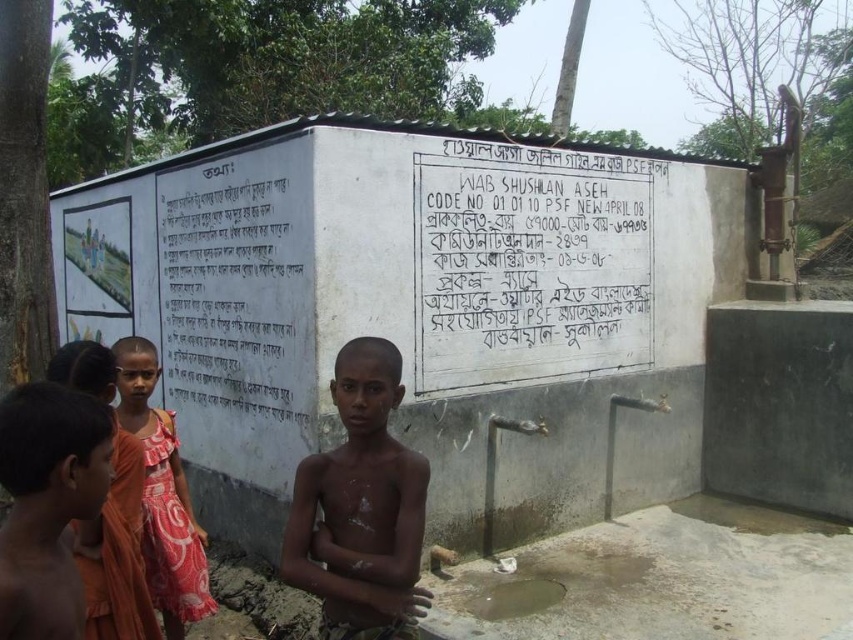
Question: Does white painted board at center lie behind orange fabric dress at lower left?

Choices:
 (A) no
 (B) yes

Answer: (B)

Question: Does white painted board at center have a larger size compared to orange cotton dress at lower left?

Choices:
 (A) no
 (B) yes

Answer: (B)

Question: Among these points, which one is farthest from the camera?

Choices:
 (A) (49, 600)
 (B) (289, 273)

Answer: (B)

Question: Which object is the farthest from the white painted board at center?

Choices:
 (A) brown skin boy at center
 (B) orange fabric dress at lower left
 (C) orange cotton dress at lower left

Answer: (B)

Question: Which of the following is the farthest from the observer?

Choices:
 (A) (175, 572)
 (B) (598, 259)

Answer: (B)

Question: In this image, where is white painted board at center located relative to brown skin boy at center?

Choices:
 (A) left
 (B) right

Answer: (B)